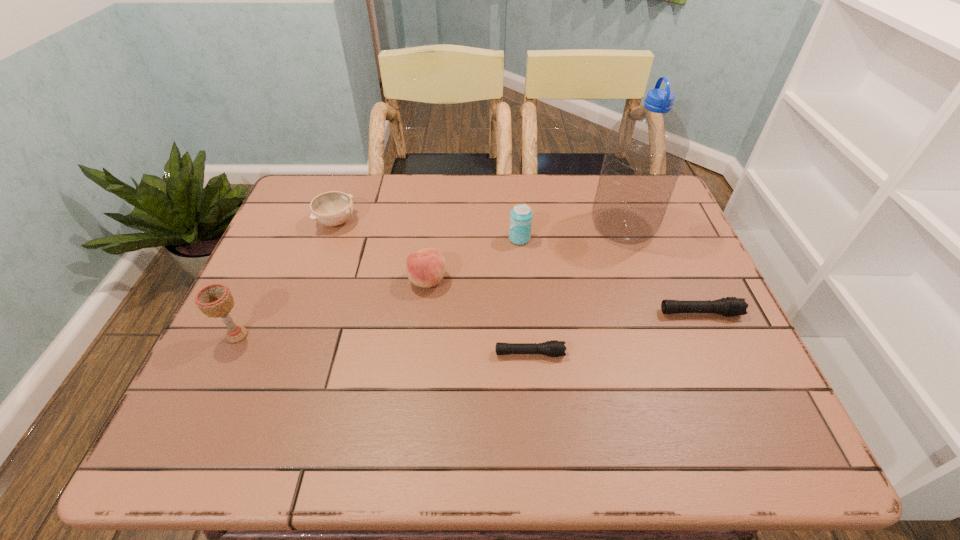
The height and width of the screenshot is (540, 960). What are the coordinates of `bowl present at the left edge` in the screenshot? It's located at (333, 208).

Image resolution: width=960 pixels, height=540 pixels. In order to click on chalice that is at the left edge in this screenshot , I will do `click(215, 300)`.

Locate an element on the screen. The image size is (960, 540). flashlight positioned at the right edge is located at coordinates (731, 306).

Where is `water jug at the right edge`? This screenshot has width=960, height=540. water jug at the right edge is located at coordinates (646, 149).

You are a GUI agent. You are given a task and a screenshot of the screen. Output one action in this format:
    pyautogui.click(x=<x>, y=<y>)
    Task: Click on the object at the far left corner
    The height and width of the screenshot is (540, 960).
    Given the screenshot: What is the action you would take?
    pyautogui.click(x=333, y=208)

In order to click on object that is at the far right corner in this screenshot , I will do `click(646, 149)`.

In the image, there is a desktop. Where is `vacant area at the far edge`? The height and width of the screenshot is (540, 960). vacant area at the far edge is located at coordinates (574, 220).

Identify the location of vacant space at the near edge of the desktop. The width and height of the screenshot is (960, 540). (372, 374).

I want to click on free space at the left edge, so click(x=282, y=235).

Locate an element on the screen. The height and width of the screenshot is (540, 960). vacant area at the right edge is located at coordinates (712, 292).